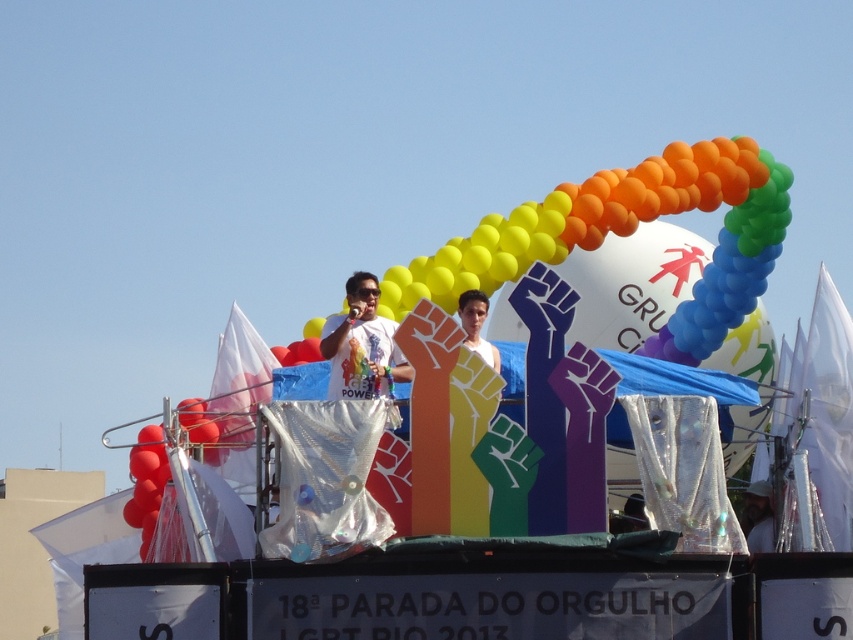
Does white glossy t-shirt at center appear over white matte shirt at center?

Yes, white glossy t-shirt at center is above white matte shirt at center.

Image resolution: width=853 pixels, height=640 pixels. Describe the element at coordinates (363, 344) in the screenshot. I see `white glossy t-shirt at center` at that location.

Between point (393, 353) and point (492, 365), which one is positioned behind?

The point (393, 353) is behind.

Where is `white glossy t-shirt at center`? Image resolution: width=853 pixels, height=640 pixels. white glossy t-shirt at center is located at coordinates click(363, 344).

Can you confirm if rainbow balloons at center is positioned to the right of white matte shirt at center?

Correct, you'll find rainbow balloons at center to the right of white matte shirt at center.

Between rainbow balloons at center and white matte shirt at center, which one appears on the left side from the viewer's perspective?

Positioned to the left is white matte shirt at center.

Which is in front, point (433, 282) or point (479, 332)?

Point (479, 332) is in front.

Locate an element on the screen. Image resolution: width=853 pixels, height=640 pixels. rainbow balloons at center is located at coordinates (636, 227).

Between rainbow balloons at center and white fabric at center, which one is positioned higher?

rainbow balloons at center is above.

What do you see at coordinates (636, 227) in the screenshot? The height and width of the screenshot is (640, 853). I see `rainbow balloons at center` at bounding box center [636, 227].

Which is behind, point (763, 243) or point (764, 532)?

Point (763, 243)

The height and width of the screenshot is (640, 853). I want to click on rainbow balloons at center, so click(x=636, y=227).